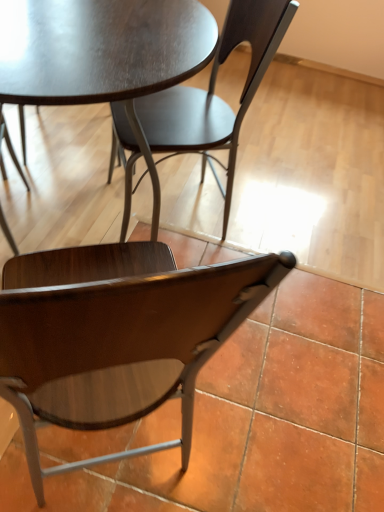
Question: Considering the relative sizes of matte dark wood chair at center, the 2th chair ordered from the bottom, and wooden chair at lower center, which ranks as the 1th chair in bottom-to-top order, in the image provided, is matte dark wood chair at center, the 2th chair ordered from the bottom, smaller than wooden chair at lower center, which ranks as the 1th chair in bottom-to-top order,?

Choices:
 (A) yes
 (B) no

Answer: (A)

Question: Is the depth of matte dark wood chair at center, the 2th chair ordered from the bottom, greater than that of wooden chair at lower center, the second chair in the top-to-bottom sequence?

Choices:
 (A) no
 (B) yes

Answer: (B)

Question: Is matte dark wood chair at center, which is the 1th chair from top to bottom, wider than wooden chair at lower center, which ranks as the 1th chair in bottom-to-top order?

Choices:
 (A) no
 (B) yes

Answer: (A)

Question: Can you confirm if matte dark wood chair at center, which is the 1th chair from top to bottom, is bigger than wooden chair at lower center, which ranks as the 1th chair in bottom-to-top order?

Choices:
 (A) yes
 (B) no

Answer: (B)

Question: Is matte dark wood chair at center, the 2th chair ordered from the bottom, positioned before wooden chair at lower center, the second chair in the top-to-bottom sequence?

Choices:
 (A) no
 (B) yes

Answer: (A)

Question: Considering the relative positions of matte dark wood chair at center, the 2th chair ordered from the bottom, and matte dark wood table at center in the image provided, is matte dark wood chair at center, the 2th chair ordered from the bottom, to the left or to the right of matte dark wood table at center?

Choices:
 (A) left
 (B) right

Answer: (B)

Question: In terms of width, does matte dark wood chair at center, which is the 1th chair from top to bottom, look wider or thinner when compared to matte dark wood table at center?

Choices:
 (A) thin
 (B) wide

Answer: (A)

Question: Is matte dark wood chair at center, which is the 1th chair from top to bottom, spatially inside matte dark wood table at center, or outside of it?

Choices:
 (A) outside
 (B) inside

Answer: (B)

Question: From the image's perspective, relative to matte dark wood table at center, is matte dark wood chair at center, which is the 1th chair from top to bottom, above or below?

Choices:
 (A) below
 (B) above

Answer: (B)

Question: From a real-world perspective, is matte dark wood table at center above or below matte dark wood chair at center, which is the 1th chair from top to bottom?

Choices:
 (A) above
 (B) below

Answer: (B)

Question: Would you say matte dark wood table at center is to the left or to the right of matte dark wood chair at center, which is the 1th chair from top to bottom, in the picture?

Choices:
 (A) right
 (B) left

Answer: (B)

Question: Is matte dark wood table at center in front of or behind matte dark wood chair at center, which is the 1th chair from top to bottom, in the image?

Choices:
 (A) behind
 (B) front

Answer: (B)

Question: Considering the positions of matte dark wood table at center and matte dark wood chair at center, which is the 1th chair from top to bottom, in the image, is matte dark wood table at center bigger or smaller than matte dark wood chair at center, which is the 1th chair from top to bottom,?

Choices:
 (A) small
 (B) big

Answer: (B)

Question: From the image's perspective, is matte dark wood table at center above or below wooden chair at lower center, which ranks as the 1th chair in bottom-to-top order?

Choices:
 (A) below
 (B) above

Answer: (B)

Question: Do you think matte dark wood table at center is within wooden chair at lower center, the second chair in the top-to-bottom sequence, or outside of it?

Choices:
 (A) outside
 (B) inside

Answer: (A)